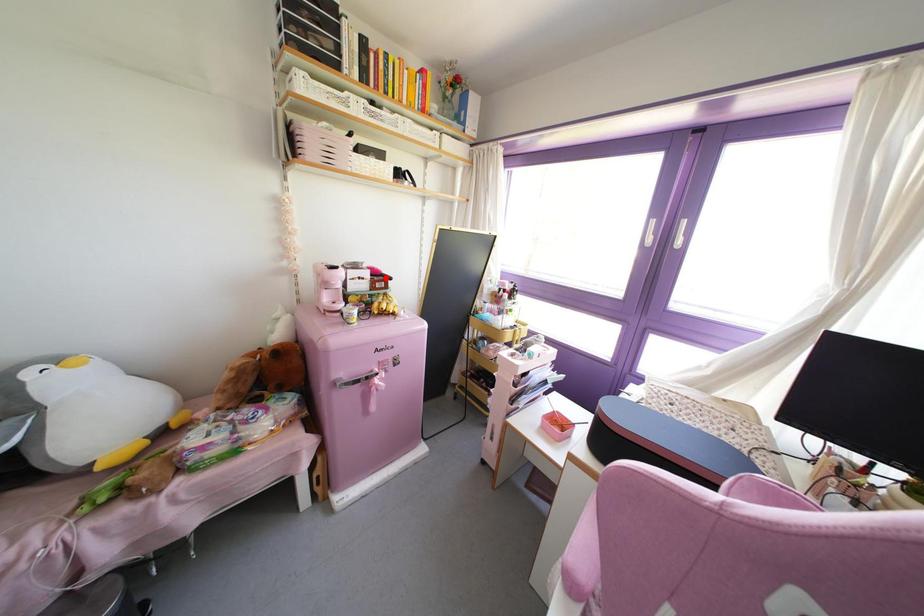
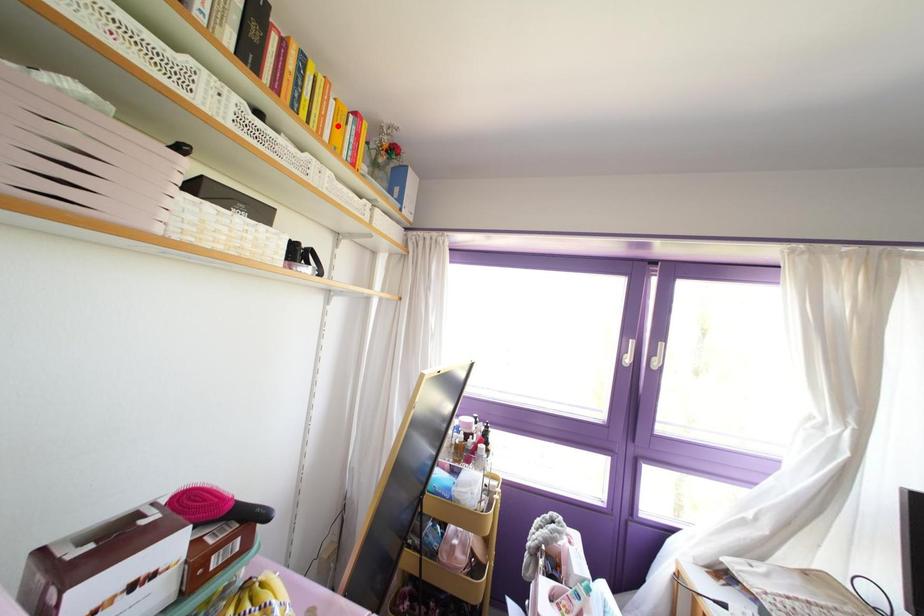
Based on the photo, I am providing you with two images of the same scene from different viewpoints. A red point is marked on the first image and another point is marked on the second image. Are the points marked in image1 and image2 representing the same 3D position?

No